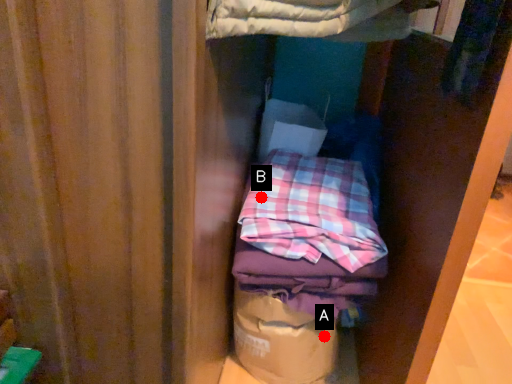
Question: Two points are circled on the image, labeled by A and B beside each circle. Which point appears farthest from the camera in this image?

Choices:
 (A) A is further
 (B) B is further

Answer: (A)